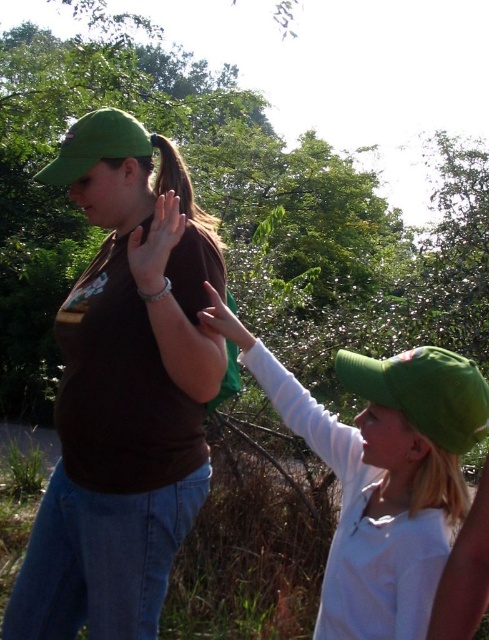
Question: Does brown matte shirt at center appear on the right side of green fabric baseball cap at right?

Choices:
 (A) no
 (B) yes

Answer: (A)

Question: Which of the following is the farthest from the observer?

Choices:
 (A) brown matte shirt at center
 (B) green fabric baseball cap at upper left
 (C) green fabric baseball cap at right

Answer: (B)

Question: Can you confirm if green fabric baseball cap at right is smaller than matte brown hand at center?

Choices:
 (A) no
 (B) yes

Answer: (A)

Question: Is green matte cap at upper right wider than green fabric baseball cap at upper left?

Choices:
 (A) no
 (B) yes

Answer: (B)

Question: Which of the following is the farthest from the observer?

Choices:
 (A) (371, 364)
 (B) (75, 177)

Answer: (B)

Question: Which of the following is the farthest from the observer?

Choices:
 (A) green fabric baseball cap at upper left
 (B) matte brown hand at center

Answer: (A)